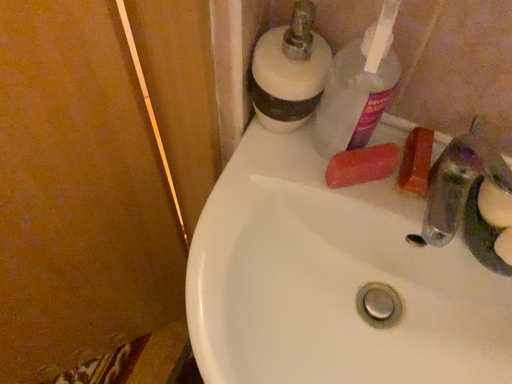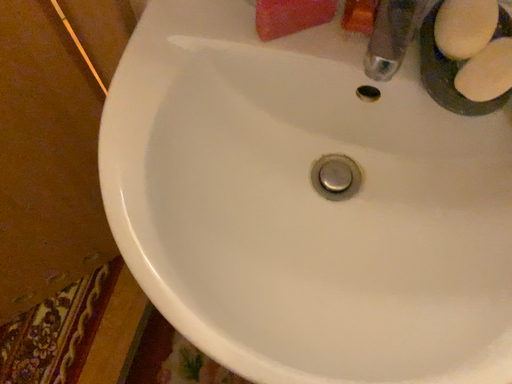
Question: How did the camera likely rotate when shooting the video?

Choices:
 (A) rotated upward
 (B) rotated downward

Answer: (B)